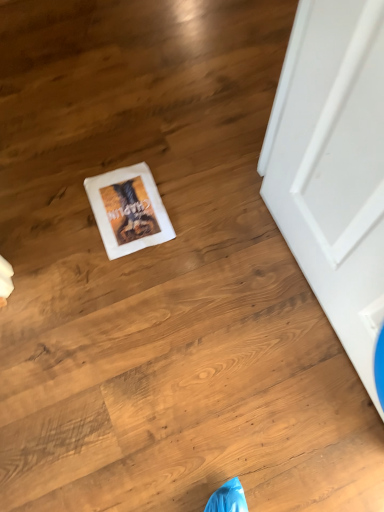
Question: From a real-world perspective, relative to white matte door at right, is white paper postcard at center vertically above or below?

Choices:
 (A) above
 (B) below

Answer: (B)

Question: Choose the correct answer: Is white paper postcard at center inside white matte door at right or outside it?

Choices:
 (A) outside
 (B) inside

Answer: (A)

Question: In terms of size, does white paper postcard at center appear bigger or smaller than white matte door at right?

Choices:
 (A) small
 (B) big

Answer: (A)

Question: In the image, is white matte door at right on the left side or the right side of white paper postcard at center?

Choices:
 (A) left
 (B) right

Answer: (B)

Question: Does point (377, 123) appear closer or farther from the camera than point (122, 206)?

Choices:
 (A) farther
 (B) closer

Answer: (B)

Question: In terms of height, does white matte door at right look taller or shorter compared to white paper postcard at center?

Choices:
 (A) tall
 (B) short

Answer: (A)

Question: In the image, is white matte door at right positioned in front of or behind white paper postcard at center?

Choices:
 (A) front
 (B) behind

Answer: (A)